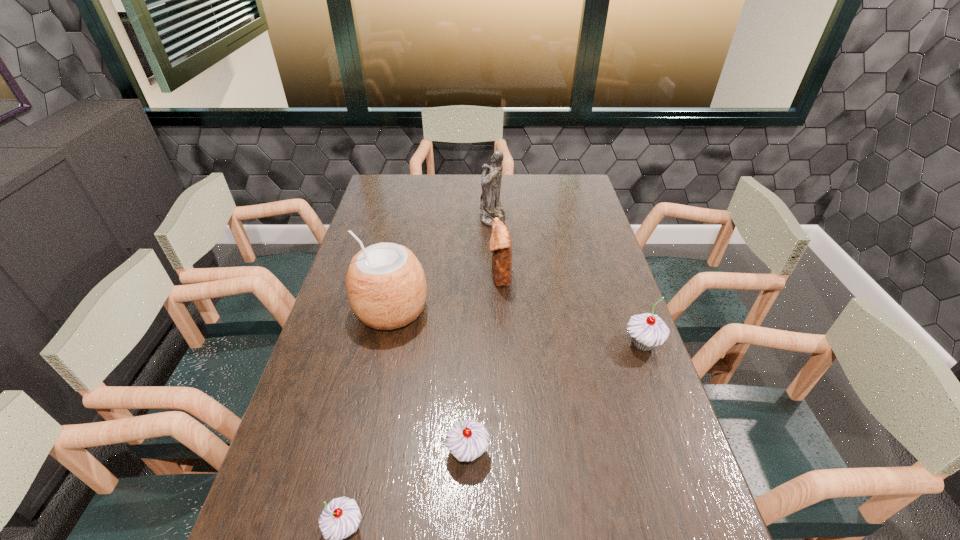
Identify which object is the second closest to the farthest cupcake. Please provide its 2D coordinates. Your answer should be formatted as a tuple, i.e. [(x, y)], where the tuple contains the x and y coordinates of a point satisfying the conditions above.

[(467, 440)]

Identify the location of the second closest cupcake relative to the farthest object. This screenshot has width=960, height=540. (467, 440).

Locate which cupcake is the second closest to the farthest cupcake. Please provide its 2D coordinates. Your answer should be formatted as a tuple, i.e. [(x, y)], where the tuple contains the x and y coordinates of a point satisfying the conditions above.

[(339, 519)]

Find the location of a particular element. The height and width of the screenshot is (540, 960). free space that satisfies the following two spatial constraints: 1. on the front-facing side of the farthest object; 2. on the left side of the rightmost object is located at coordinates (497, 344).